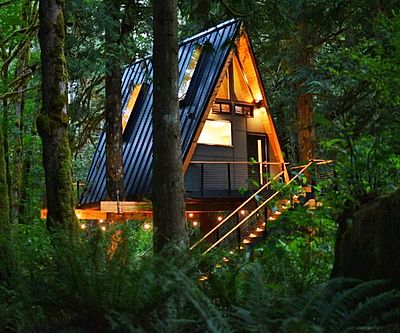
At what (x,y) coordinates should I click in order to perform the action: click on window in door. Please return your answer as a coordinate pair (x, y). Looking at the image, I should click on 259,152.